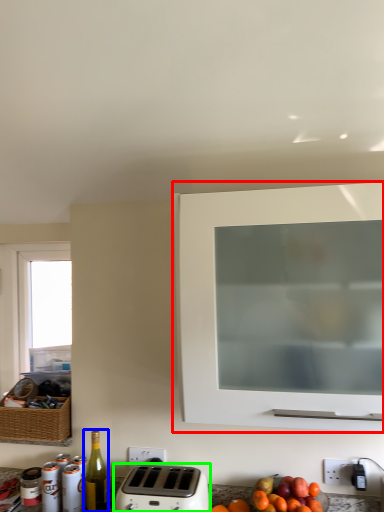
Question: Considering the real-world distances, which object is closest to cabinetry (highlighted by a red box)? bottle (highlighted by a blue box) or toaster (highlighted by a green box).

Choices:
 (A) bottle
 (B) toaster

Answer: (B)